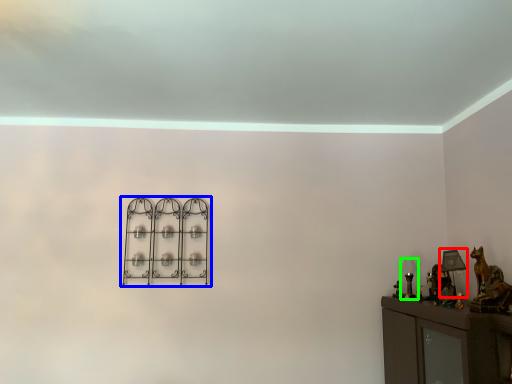
Question: Estimate the real-world distances between objects in this image. Which object is farther from table lamp (highlighted by a red box), shelf (highlighted by a blue box) or table lamp (highlighted by a green box)?

Choices:
 (A) shelf
 (B) table lamp

Answer: (A)